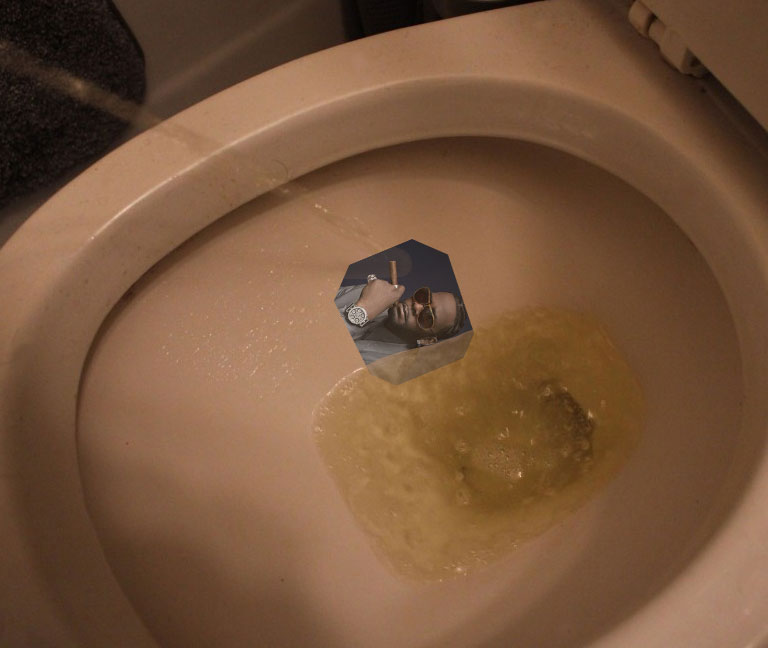
The image size is (768, 648). I want to click on porcelain, so (x=101, y=236).